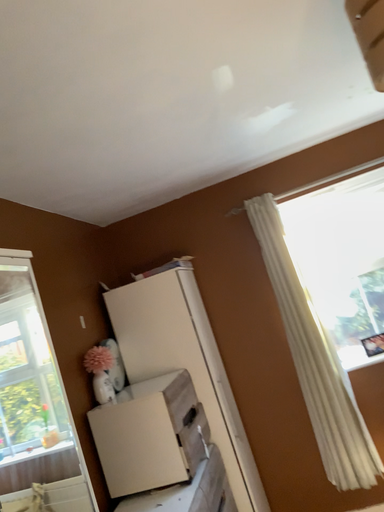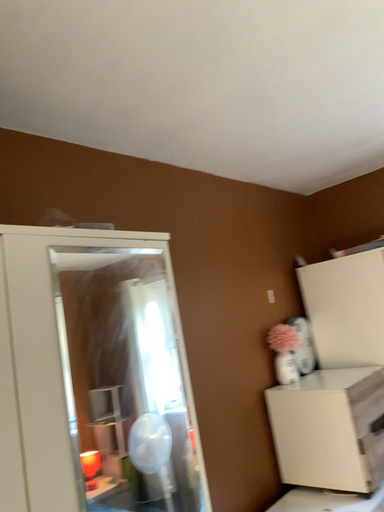
Question: How did the camera likely rotate when shooting the video?

Choices:
 (A) rotated left
 (B) rotated right

Answer: (A)